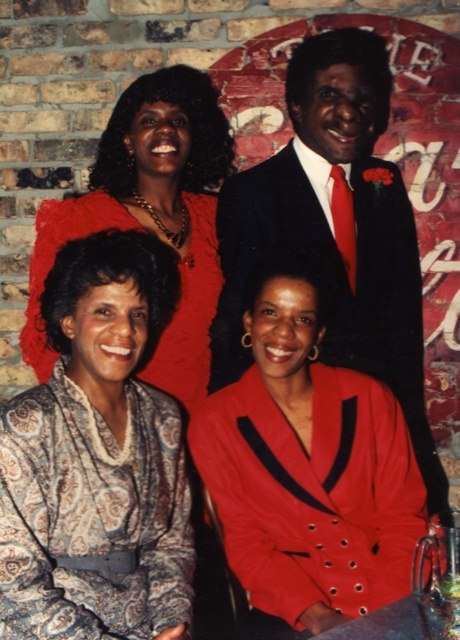
Question: Can you confirm if paisley fabric dress at lower left is bigger than metallic silver table at lower center?

Choices:
 (A) yes
 (B) no

Answer: (A)

Question: Which object appears closest to the camera in this image?

Choices:
 (A) shiny black suit at upper center
 (B) metallic silver table at lower center
 (C) shiny red blazer at center
 (D) paisley fabric dress at lower left

Answer: (B)

Question: Can you confirm if paisley-patterned dress at lower left is positioned above shiny red blazer at center?

Choices:
 (A) yes
 (B) no

Answer: (A)

Question: Among these points, which one is farthest from the camera?

Choices:
 (A) (352, 108)
 (B) (396, 616)

Answer: (A)

Question: Does paisley-patterned dress at lower left have a greater width compared to paisley fabric dress at lower left?

Choices:
 (A) yes
 (B) no

Answer: (B)

Question: Which point appears farthest from the camera in this image?

Choices:
 (A) (303, 419)
 (B) (377, 636)
 (C) (17, 467)

Answer: (A)